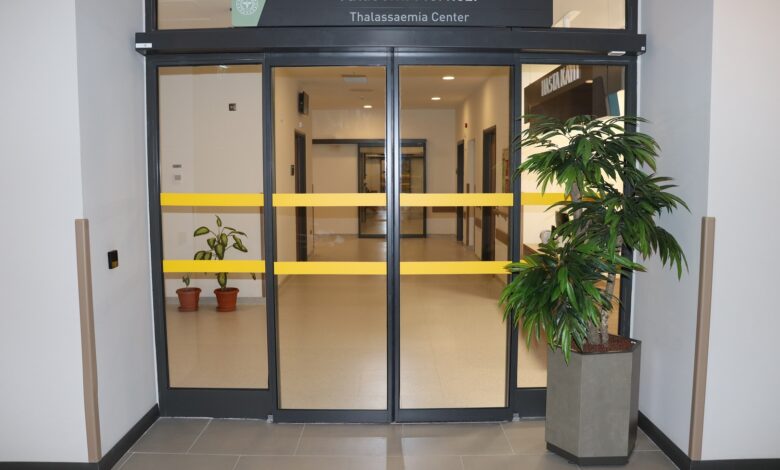
Where is `plant containers`? The image size is (780, 470). plant containers is located at coordinates (600, 392), (186, 294), (227, 298).